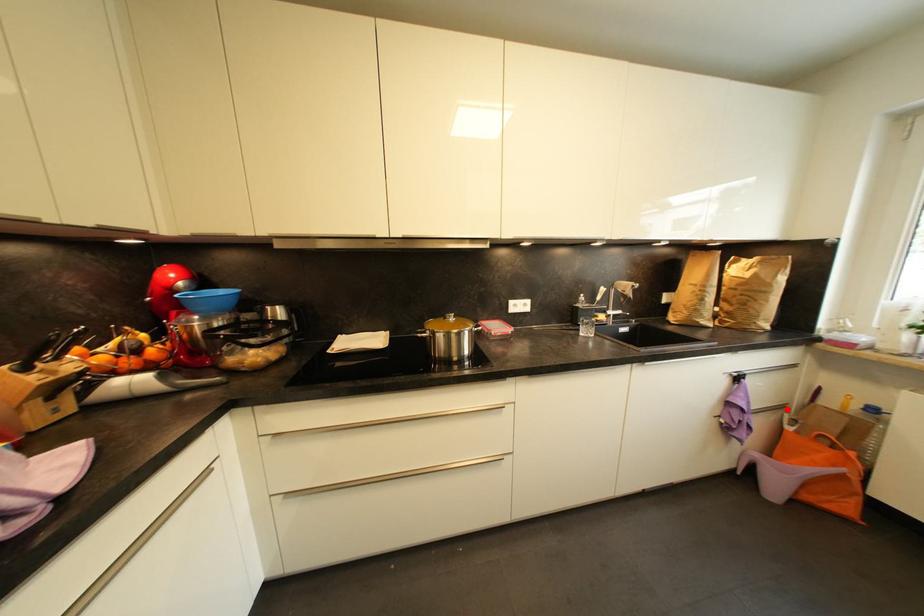
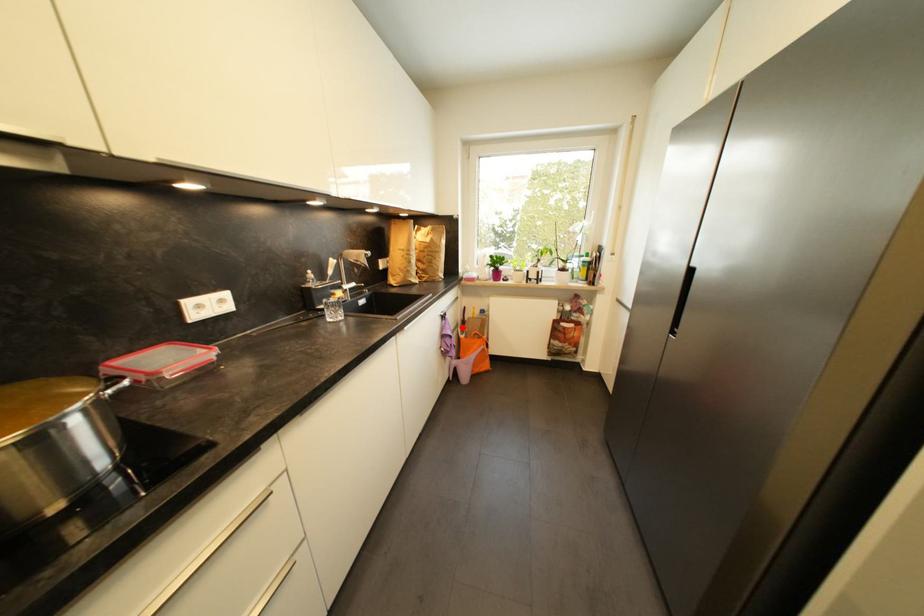
I am providing you with two images of the same scene from different viewpoints. A red point is marked on the first image and another point is marked on the second image. Does the point marked in image1 correspond to the same location as the one in image2?

Yes